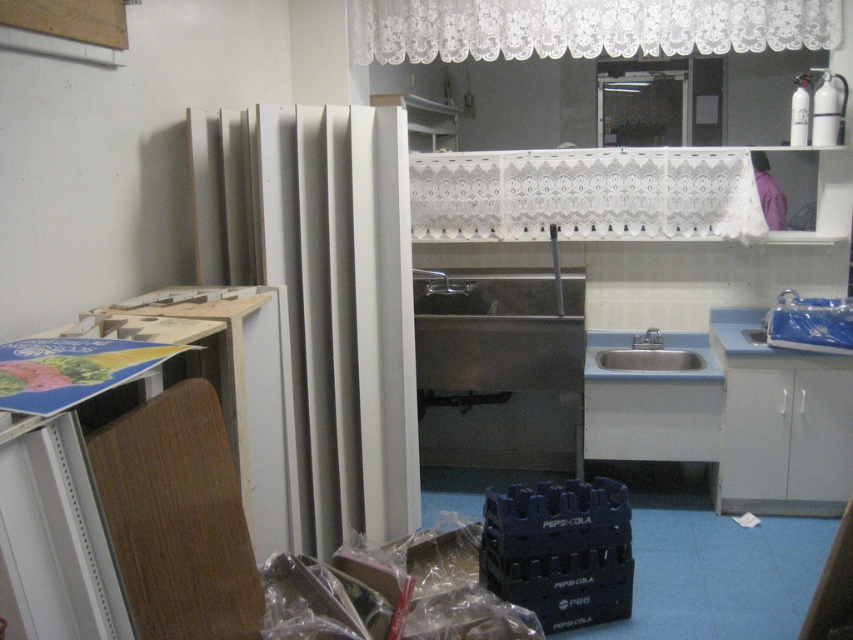
You are standing in the kitchen and want to hang a new lace curtain exactly where the white lace curtain at upper center is currently located. What are the coordinates of the spot where you should place the new curtain?

The coordinates for the white lace curtain at upper center are at point (584, 28), so you should place the new curtain there.

You are organizing the kitchen and need to place a new appliance next to the satin silver sink at center. There is a white lace curtain at upper center nearby. Which side of the sink should you avoid placing the appliance to ensure it doesn not block the curtain?

You should avoid placing the appliance to the left side of the satin silver sink at center because the white lace curtain at upper center is located to the left of it.

You are a decorator trying to hang a new curtain rod in the kitchen. You see the white lace curtain at upper center and the satin silver sink at center. Which object is wider, and will the curtain rod need to be adjusted to fit over the sink?

The white lace curtain at upper center is wider than the satin silver sink at center. Therefore, the curtain rod will need to be adjusted to ensure it spans the width of the curtain while accommodating the sink below.